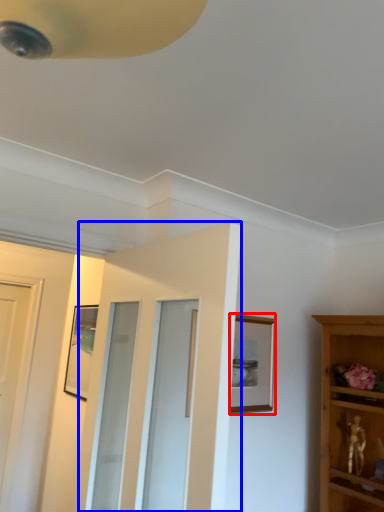
Question: Which object appears closest to the camera in this image, picture frame (highlighted by a red box) or door (highlighted by a blue box)?

Choices:
 (A) picture frame
 (B) door

Answer: (B)